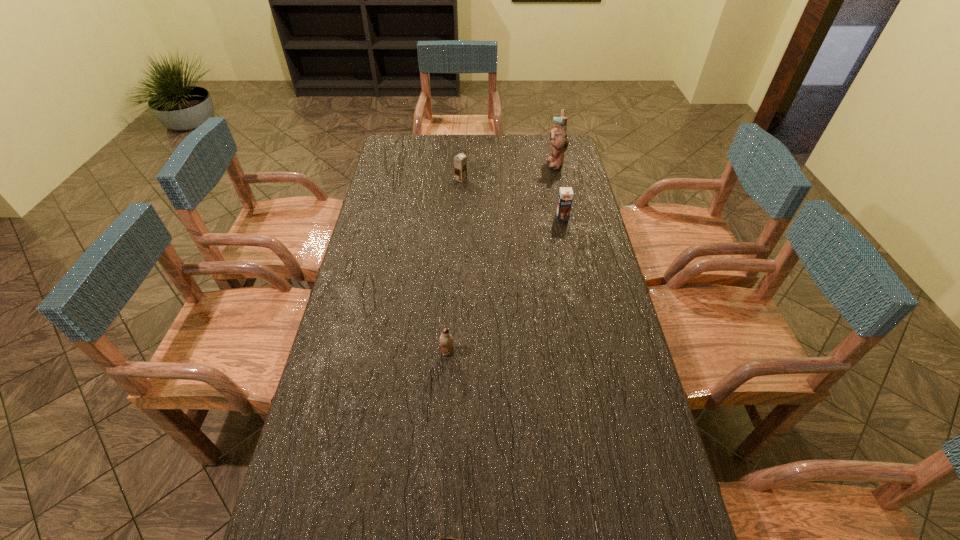
Where is `blank space located on the right of the farthest chocolate milk`? blank space located on the right of the farthest chocolate milk is located at coordinates (500, 179).

Locate an element on the screen. Image resolution: width=960 pixels, height=540 pixels. vacant region located 0.400m on the right of the second nearest object is located at coordinates (592, 352).

At what (x,y) coordinates should I click in order to perform the action: click on object that is at the far edge. Please return your answer as a coordinate pair (x, y). The height and width of the screenshot is (540, 960). Looking at the image, I should click on (558, 136).

Where is `figurine that is at the right edge`? This screenshot has width=960, height=540. figurine that is at the right edge is located at coordinates (558, 136).

This screenshot has width=960, height=540. In order to click on chocolate milk situated at the right edge in this screenshot , I will do `click(565, 197)`.

Locate an element on the screen. The width and height of the screenshot is (960, 540). object that is at the far right corner is located at coordinates (558, 136).

This screenshot has width=960, height=540. In the image, there is a desktop. What are the coordinates of `free space at the far edge` in the screenshot? It's located at (439, 147).

In the image, there is a desktop. Identify the location of free space at the left edge. The height and width of the screenshot is (540, 960). (357, 369).

Identify the location of vacant space at the right edge of the desktop. (545, 176).

Locate an element on the screen. The width and height of the screenshot is (960, 540). free region at the far right corner is located at coordinates (544, 155).